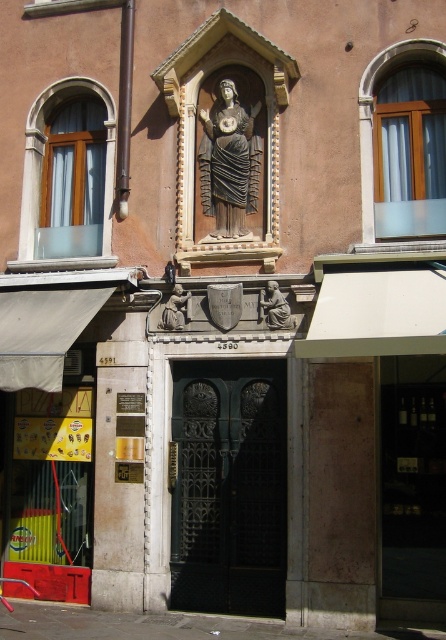
You are an art conservator examining the facade of a building. You notice two statues, the dark gray stone statue at center and the matte gray stone statue at center. Which statue is positioned to the left side of the other?

The dark gray stone statue at center is to the left of the matte gray stone statue at center.